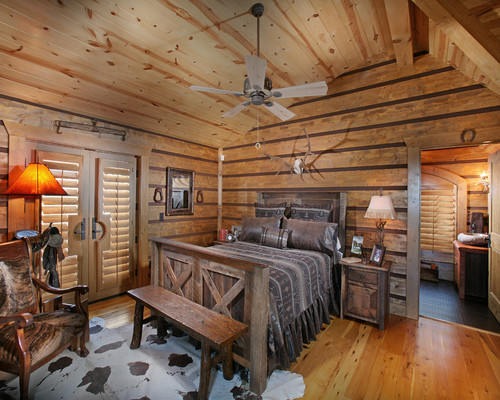
What are the coordinates of `door handle` in the screenshot? It's located at (95, 225), (82, 229).